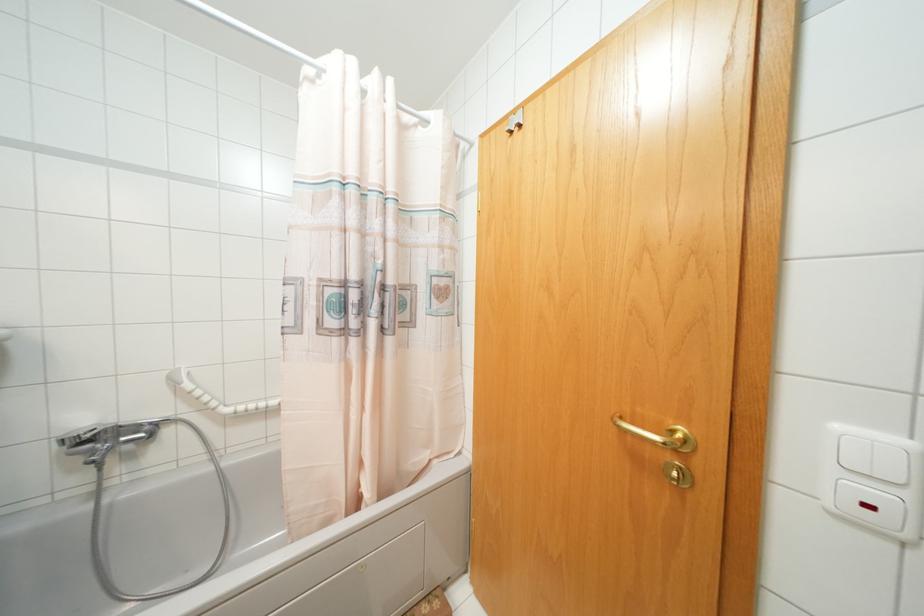
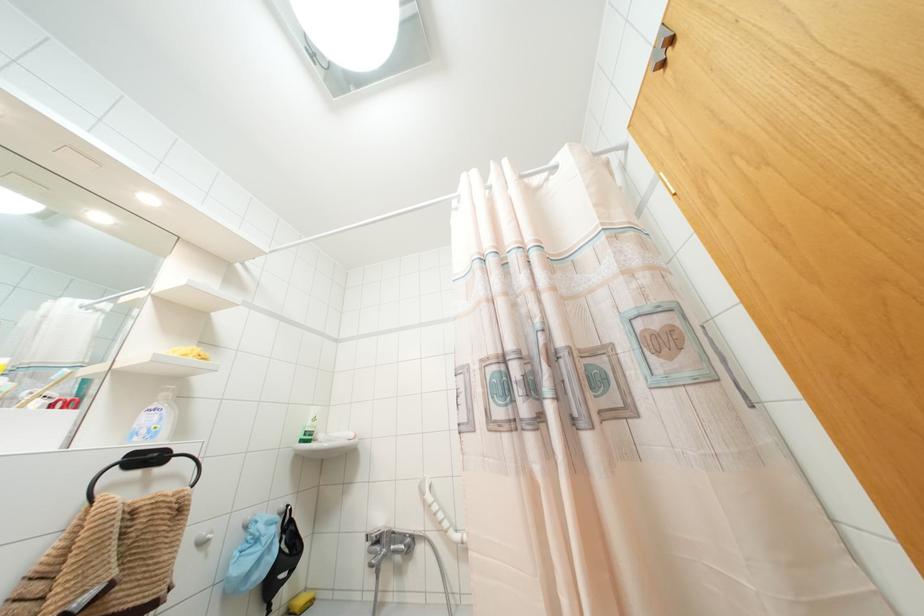
In the second image, find the point that corresponds to the point at 118,435 in the first image.

(390, 541)